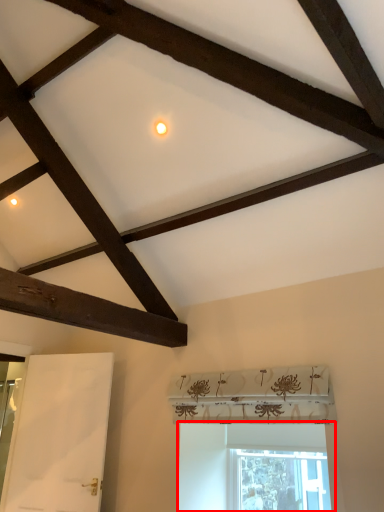
Question: In this image, where is window (annotated by the red box) located relative to screen door?

Choices:
 (A) right
 (B) left

Answer: (A)